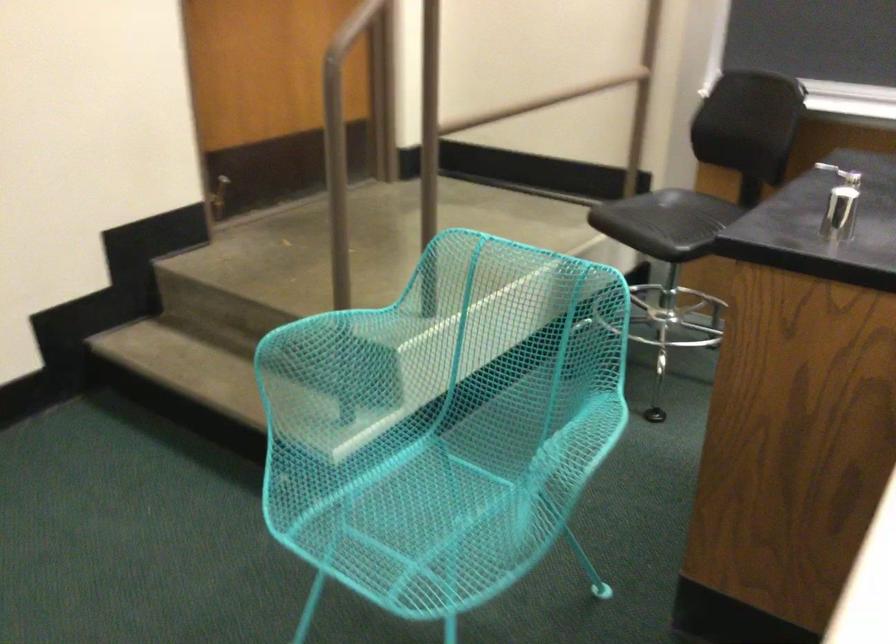
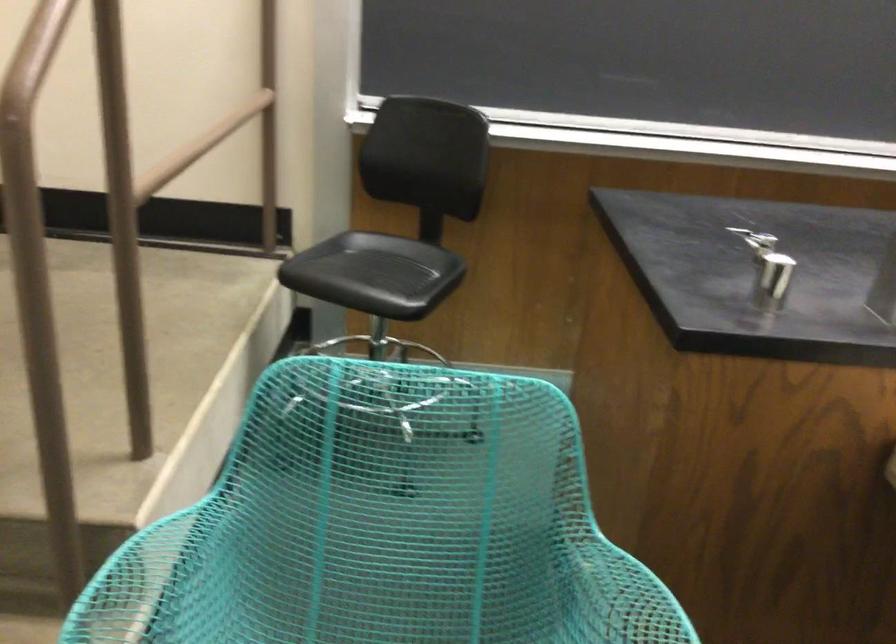
The point at [467,422] is marked in the first image. Where is the corresponding point in the second image?

(350, 619)